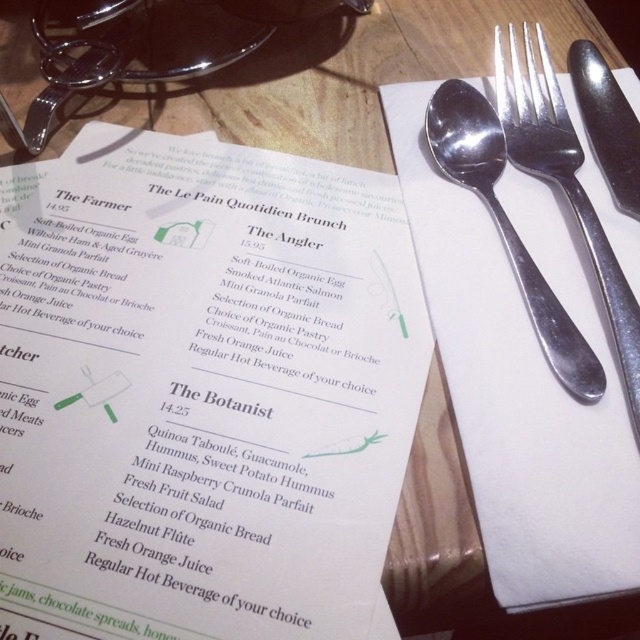
Does white paper menu at upper left have a lesser width compared to polished metal knife at right?

Incorrect, white paper menu at upper left's width is not less than polished metal knife at right's.

Who is lower down, white paper menu at upper left or polished metal knife at right?

white paper menu at upper left is lower down.

What do you see at coordinates (200, 390) in the screenshot? The height and width of the screenshot is (640, 640). I see `white paper menu at upper left` at bounding box center [200, 390].

Image resolution: width=640 pixels, height=640 pixels. I want to click on white paper menu at upper left, so click(200, 390).

Who is positioned more to the right, white paper menu at upper left or polished silver fork at upper right?

From the viewer's perspective, polished silver fork at upper right appears more on the right side.

Is point (148, 484) closer to camera compared to point (620, 282)?

Yes.

The image size is (640, 640). What do you see at coordinates (200, 390) in the screenshot?
I see `white paper menu at upper left` at bounding box center [200, 390].

Image resolution: width=640 pixels, height=640 pixels. Identify the location of white paper menu at upper left. (200, 390).

Can you confirm if polished silver fork at upper right is taller than satin silver spoon at upper right?

Correct, polished silver fork at upper right is much taller as satin silver spoon at upper right.

Does polished silver fork at upper right have a lesser height compared to satin silver spoon at upper right?

No, polished silver fork at upper right is not shorter than satin silver spoon at upper right.

Is point (576, 141) farther from camera compared to point (592, 371)?

Yes, point (576, 141) is farther from viewer.

Locate an element on the screen. The height and width of the screenshot is (640, 640). polished silver fork at upper right is located at coordinates (564, 188).